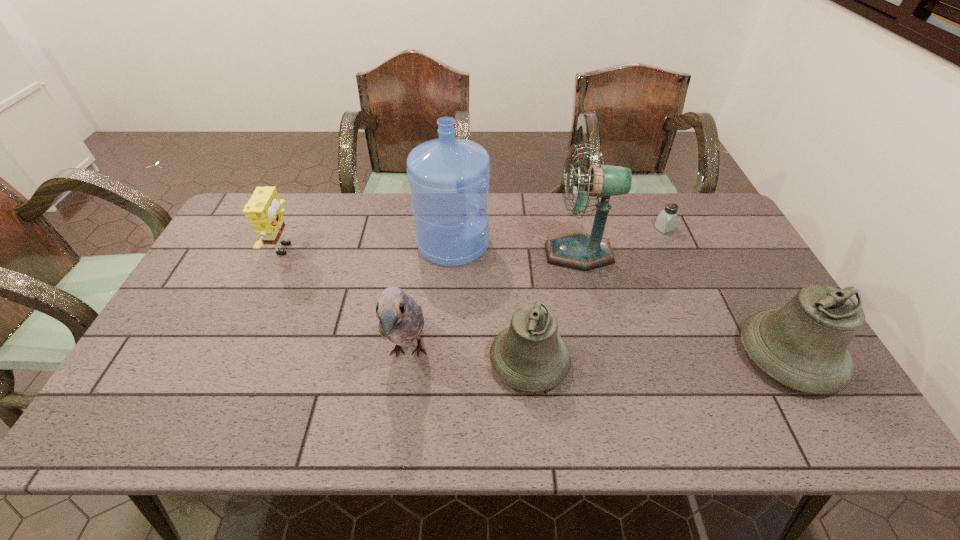
At what (x,y) coordinates should I click in order to perform the action: click on vacant region at the far right corner. Please return your answer as a coordinate pair (x, y). Image resolution: width=960 pixels, height=540 pixels. Looking at the image, I should click on (696, 198).

Image resolution: width=960 pixels, height=540 pixels. What are the coordinates of `vacant space that is in between the fourth shortest object and the water jug` in the screenshot? It's located at (621, 300).

Image resolution: width=960 pixels, height=540 pixels. In order to click on free space between the rightmost object and the parrot in this screenshot , I will do `click(599, 354)`.

Where is `vacant area that lies between the water jug and the fan`? vacant area that lies between the water jug and the fan is located at coordinates (516, 248).

Where is `vacant area that lies between the parrot and the shortest object`? vacant area that lies between the parrot and the shortest object is located at coordinates (536, 291).

Locate an element on the screen. Image resolution: width=960 pixels, height=540 pixels. empty space that is in between the parrot and the shortest object is located at coordinates (536, 291).

Identify the location of free point between the water jug and the fan. The height and width of the screenshot is (540, 960). (516, 248).

Identify the location of free point between the fan and the water jug. The image size is (960, 540). (516, 248).

At what (x,y) coordinates should I click in order to perform the action: click on vacant space that is in between the fan and the sixth object from left to right. Please return your answer as a coordinate pair (x, y). The width and height of the screenshot is (960, 540). Looking at the image, I should click on (621, 241).

Where is `object that is the closest one to the leftmost object`? This screenshot has width=960, height=540. object that is the closest one to the leftmost object is located at coordinates (449, 178).